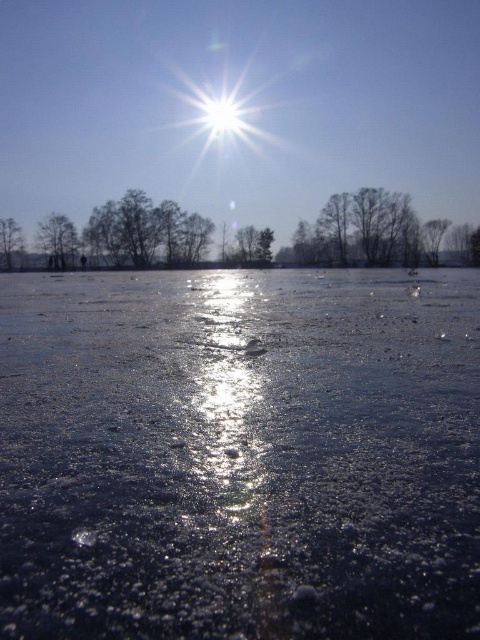
You are an observer standing at the edge of the frozen lake. You see the transparent ice at center and the silvery metallic tree at upper left. Which object appears taller in the image?

The silvery metallic tree at upper left appears taller than the transparent ice at center in the image.